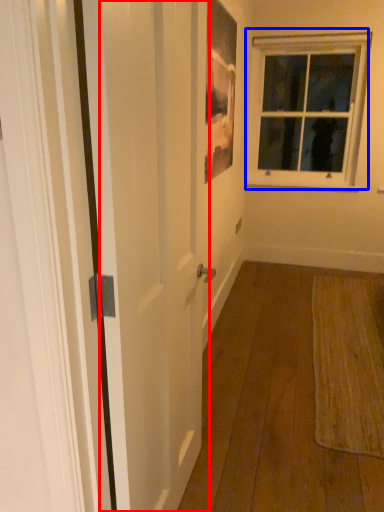
Question: Among these objects, which one is farthest to the camera, screen door (highlighted by a red box) or window (highlighted by a blue box)?

Choices:
 (A) screen door
 (B) window

Answer: (B)